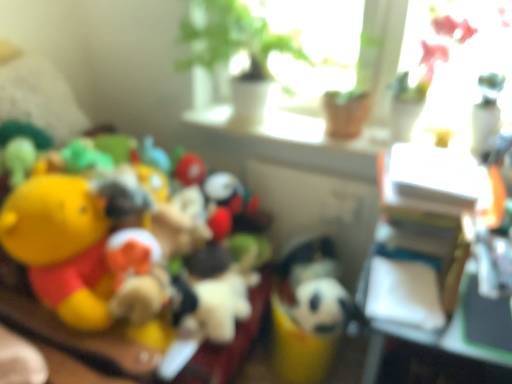
Question: In terms of height, does yellow plush toy at left, the 1th toy in the left-to-right sequence, look taller or shorter compared to black plush toy at center?

Choices:
 (A) tall
 (B) short

Answer: (A)

Question: Based on their sizes in the image, would you say yellow plush toy at left, the 2th toy positioned from the right, is bigger or smaller than black plush toy at center?

Choices:
 (A) big
 (B) small

Answer: (A)

Question: Based on their relative distances, which object is farther from the black plush toy at center?

Choices:
 (A) yellow plush toy at left, the 2th toy positioned from the right
 (B) white plush toy at center, which is the 1th toy from right to left
 (C) white glossy window sill at upper center
 (D) white plastic table at right

Answer: (C)

Question: Based on their relative distances, which object is farther from the black plush toy at center?

Choices:
 (A) yellow plush toy at left, the 1th toy in the left-to-right sequence
 (B) white glossy window sill at upper center
 (C) white plastic table at right
 (D) white plush toy at center, which is the 2th toy in left-to-right order

Answer: (B)